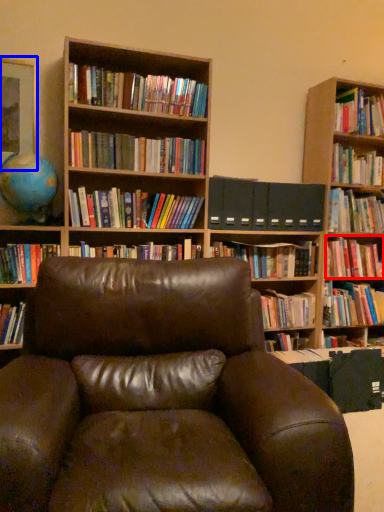
Question: Which point is further to the camera, book (highlighted by a red box) or picture frame (highlighted by a blue box)?

Choices:
 (A) book
 (B) picture frame

Answer: (A)